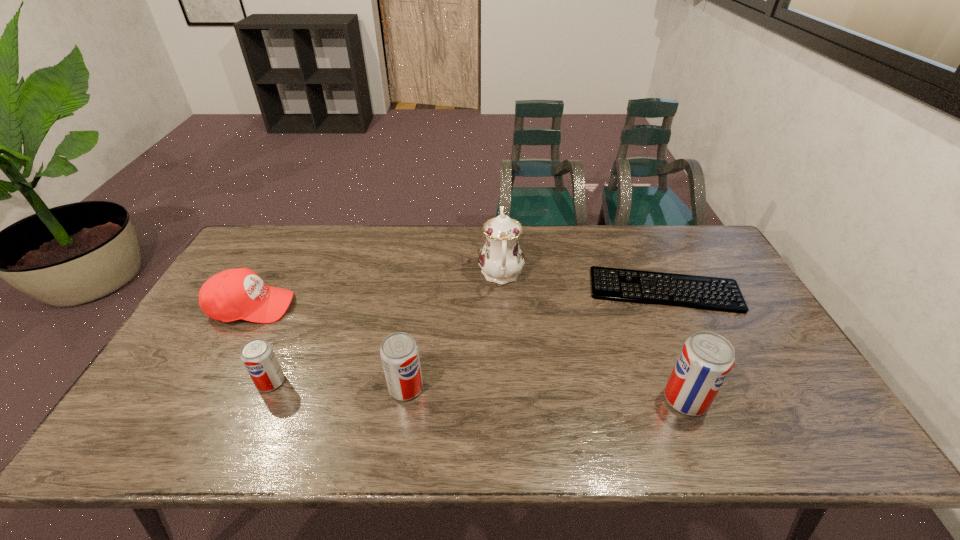
Identify the location of the fourth closest object relative to the chinaware. Image resolution: width=960 pixels, height=540 pixels. (234, 294).

Select which object is the second closest to the chinaware. Please provide its 2D coordinates. Your answer should be formatted as a tuple, i.e. [(x, y)], where the tuple contains the x and y coordinates of a point satisfying the conditions above.

[(399, 352)]

Locate an element on the screen. The height and width of the screenshot is (540, 960). soda object that ranks as the closest to the second tallest object is located at coordinates (399, 352).

Identify which soda is located as the nearest to the shortest object. Please provide its 2D coordinates. Your answer should be formatted as a tuple, i.e. [(x, y)], where the tuple contains the x and y coordinates of a point satisfying the conditions above.

[(706, 359)]

Identify the location of vacant area that satisfies the following two spatial constraints: 1. on the front panel of the second tallest object; 2. on the left side of the baseball cap. (200, 400).

Image resolution: width=960 pixels, height=540 pixels. I want to click on vacant area that satisfies the following two spatial constraints: 1. on the front panel of the baseball cap; 2. on the right side of the fourth object from right to left, so click(206, 388).

Locate an element on the screen. blank space that satisfies the following two spatial constraints: 1. on the back side of the leftmost soda; 2. on the left side of the shortest object is located at coordinates (310, 290).

Identify the location of vacant region that satisfies the following two spatial constraints: 1. on the front panel of the baseball cap; 2. on the left side of the fourth shortest object. This screenshot has width=960, height=540. (206, 388).

I want to click on vacant space that satisfies the following two spatial constraints: 1. on the front panel of the second soda from right to left; 2. on the left side of the baseball cap, so click(206, 388).